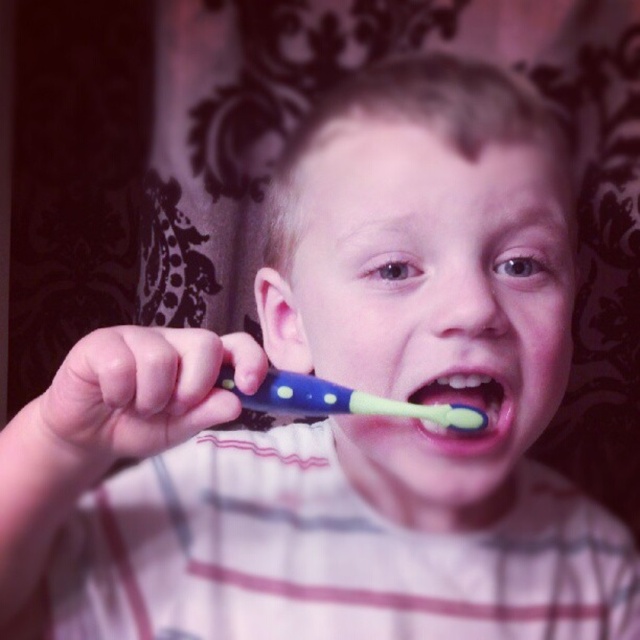
Question: Where is blue rubber toothbrush at center located in relation to green rubber toothbrush at center in the image?

Choices:
 (A) left
 (B) right

Answer: (A)

Question: Among these points, which one is nearest to the camera?

Choices:
 (A) (438, 436)
 (B) (266, 384)

Answer: (B)

Question: Which point is closer to the camera?

Choices:
 (A) (269, 378)
 (B) (506, 392)

Answer: (A)

Question: Considering the relative positions of blue rubber toothbrush at center and green rubber toothbrush at center in the image provided, where is blue rubber toothbrush at center located with respect to green rubber toothbrush at center?

Choices:
 (A) above
 (B) below

Answer: (A)

Question: Which of the following is the closest to the observer?

Choices:
 (A) green rubber toothbrush at center
 (B) blue rubber toothbrush at center

Answer: (B)

Question: Is blue rubber toothbrush at center to the left of green rubber toothbrush at center from the viewer's perspective?

Choices:
 (A) yes
 (B) no

Answer: (A)